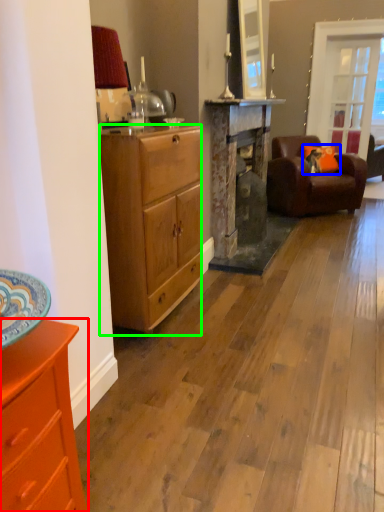
Question: Which is nearer to the cabinetry (highlighted by a red box)? pillow (highlighted by a blue box) or desk (highlighted by a green box).

Choices:
 (A) pillow
 (B) desk

Answer: (B)